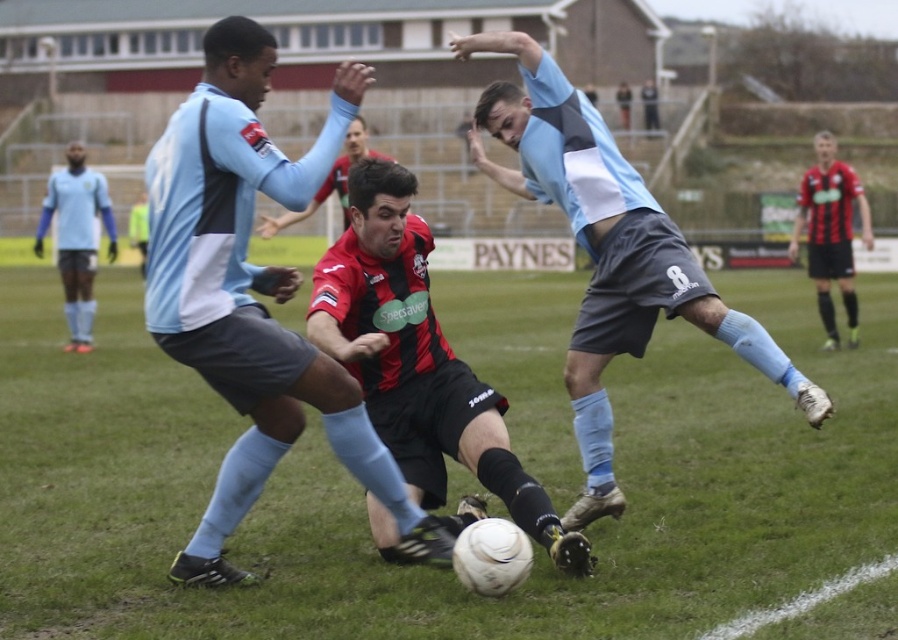
Which is more to the right, matte blue shorts at center or light blue jersey at center?

From the viewer's perspective, light blue jersey at center appears more on the right side.

Locate an element on the screen. The height and width of the screenshot is (640, 898). matte blue shorts at center is located at coordinates (251, 296).

This screenshot has height=640, width=898. What do you see at coordinates (606, 252) in the screenshot?
I see `light blue jersey at center` at bounding box center [606, 252].

Between point (551, 150) and point (826, 250), which one is positioned in front?

Positioned in front is point (551, 150).

Find the location of a particular element. The height and width of the screenshot is (640, 898). light blue jersey at center is located at coordinates (606, 252).

Does green grass at center have a greater width compared to matte blue shorts at center?

Yes.

Can you confirm if green grass at center is positioned above matte blue shorts at center?

Incorrect, green grass at center is not positioned above matte blue shorts at center.

Describe the element at coordinates (362, 493) in the screenshot. I see `green grass at center` at that location.

At what (x,y) coordinates should I click in order to perform the action: click on green grass at center. Please return your answer as a coordinate pair (x, y). This screenshot has width=898, height=640. Looking at the image, I should click on (362, 493).